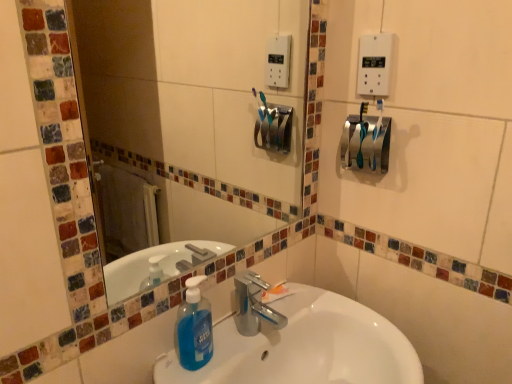
Measure the distance between point (365, 75) and camera.

The distance of point (365, 75) from camera is 1.04 meters.

This screenshot has width=512, height=384. Describe the element at coordinates (198, 102) in the screenshot. I see `glass mosaic mirror at upper center` at that location.

This screenshot has width=512, height=384. Describe the element at coordinates (194, 327) in the screenshot. I see `blue translucent liquid soap at center` at that location.

At what (x,y) coordinates should I click in order to perform the action: click on white plastic light switch at upper right. Please return your answer as a coordinate pair (x, y). The height and width of the screenshot is (384, 512). Looking at the image, I should click on (376, 64).

Considering the positions of objects white glossy sink at center and blue translucent liquid soap at center in the image provided, who is behind, white glossy sink at center or blue translucent liquid soap at center?

blue translucent liquid soap at center is behind.

Is point (228, 371) closer or farther from the camera than point (190, 323)?

Clearly, point (228, 371) is more distant from the camera than point (190, 323).

Where is `sink located on the right of blue translucent liquid soap at center`? The height and width of the screenshot is (384, 512). sink located on the right of blue translucent liquid soap at center is located at coordinates pos(304,346).

In the scene shown: Could blue translucent liquid soap at center be considered to be inside white glossy sink at center?

Yes, white glossy sink at center is surrounding blue translucent liquid soap at center.

Who is taller, white plastic light switch at upper right or white glossy sink at center?

Standing taller between the two is white glossy sink at center.

Considering the positions of objects white plastic light switch at upper right and white glossy sink at center in the image provided, who is more to the right, white plastic light switch at upper right or white glossy sink at center?

white plastic light switch at upper right.

Is white plastic light switch at upper right directly adjacent to white glossy sink at center?

No.

Are white plastic light switch at upper right and glass mosaic mirror at upper center far apart?

No, white plastic light switch at upper right is in close proximity to glass mosaic mirror at upper center.

From the picture: Based on their positions, is white plastic light switch at upper right located to the left or right of glass mosaic mirror at upper center?

Based on their positions, white plastic light switch at upper right is located to the right of glass mosaic mirror at upper center.

Considering the relative sizes of white plastic light switch at upper right and glass mosaic mirror at upper center in the image provided, is white plastic light switch at upper right taller than glass mosaic mirror at upper center?

No, white plastic light switch at upper right is not taller than glass mosaic mirror at upper center.

Is white plastic light switch at upper right inside or outside of glass mosaic mirror at upper center?

white plastic light switch at upper right exists outside the volume of glass mosaic mirror at upper center.

Would you say white plastic light switch at upper right contains blue translucent liquid soap at center?

No, white plastic light switch at upper right does not contain blue translucent liquid soap at center.

Between white plastic light switch at upper right and blue translucent liquid soap at center, which one is positioned behind?

white plastic light switch at upper right.

Considering the sizes of objects white plastic light switch at upper right and blue translucent liquid soap at center in the image provided, who is thinner, white plastic light switch at upper right or blue translucent liquid soap at center?

white plastic light switch at upper right.

Visually, is white plastic light switch at upper right positioned to the left or to the right of blue translucent liquid soap at center?

In the image, white plastic light switch at upper right appears on the right side of blue translucent liquid soap at center.

Is white glossy sink at center shorter than white plastic light switch at upper right?

In fact, white glossy sink at center may be taller than white plastic light switch at upper right.

Does white glossy sink at center appear on the left side of white plastic light switch at upper right?

Yes, white glossy sink at center is to the left of white plastic light switch at upper right.

Looking at this image, which point is more distant from viewer, (292, 363) or (387, 88)?

Positioned behind is point (292, 363).

This screenshot has height=384, width=512. I want to click on light switch that is in front of the satin silver towel bar at upper right, so click(376, 64).

Is satin silver towel bar at upper right not within white plastic light switch at upper right?

Yes, satin silver towel bar at upper right is located beyond the bounds of white plastic light switch at upper right.

Is satin silver towel bar at upper right wider than white plastic light switch at upper right?

Yes.

From the image's perspective, who appears lower, satin silver towel bar at upper right or white plastic light switch at upper right?

satin silver towel bar at upper right is shown below in the image.

Does blue translucent liquid soap at center have a lesser width compared to satin silver towel bar at upper right?

No, blue translucent liquid soap at center is not thinner than satin silver towel bar at upper right.

In order to click on cleaning product located in front of the satin silver towel bar at upper right in this screenshot , I will do `click(194, 327)`.

Which is less distant, (x=186, y=357) or (x=383, y=154)?

Point (x=186, y=357) is closer to the camera than point (x=383, y=154).

The height and width of the screenshot is (384, 512). I want to click on cleaning product above the white glossy sink at center (from the image's perspective), so click(194, 327).

At what (x,y) coordinates should I click in order to perform the action: click on sink below the white plastic light switch at upper right (from the image's perspective). Please return your answer as a coordinate pair (x, y). Looking at the image, I should click on [304, 346].

Based on their spatial positions, is satin silver towel bar at upper right or glass mosaic mirror at upper center further from white plastic light switch at upper right?

glass mosaic mirror at upper center.

Looking at the image, which one is located further to blue translucent liquid soap at center, glass mosaic mirror at upper center or white glossy sink at center?

Based on the image, glass mosaic mirror at upper center appears to be further to blue translucent liquid soap at center.

Based on their spatial positions, is satin silver towel bar at upper right or white plastic light switch at upper right further from glass mosaic mirror at upper center?

white plastic light switch at upper right is positioned further to the anchor glass mosaic mirror at upper center.

Looking at the image, which one is located closer to white plastic light switch at upper right, satin silver towel bar at upper right or blue translucent liquid soap at center?

satin silver towel bar at upper right is positioned closer to the anchor white plastic light switch at upper right.

Looking at the image, which one is located further to satin silver towel bar at upper right, white glossy sink at center or blue translucent liquid soap at center?

blue translucent liquid soap at center is further to satin silver towel bar at upper right.

Looking at the image, which one is located further to satin silver towel bar at upper right, white glossy sink at center or white plastic light switch at upper right?

Based on the image, white glossy sink at center appears to be further to satin silver towel bar at upper right.

Estimate the real-world distances between objects in this image. Which object is further from white plastic light switch at upper right, satin silver towel bar at upper right or white glossy sink at center?

white glossy sink at center lies further to white plastic light switch at upper right than the other object.

Considering their positions, is glass mosaic mirror at upper center positioned further to blue translucent liquid soap at center than satin silver towel bar at upper right?

glass mosaic mirror at upper center is positioned further to the anchor blue translucent liquid soap at center.

Find the location of `towel bar between white plastic light switch at upper right and blue translucent liquid soap at center in the up-down direction`. towel bar between white plastic light switch at upper right and blue translucent liquid soap at center in the up-down direction is located at coordinates [366, 144].

The width and height of the screenshot is (512, 384). Find the location of `cleaning product between satin silver towel bar at upper right and white glossy sink at center vertically`. cleaning product between satin silver towel bar at upper right and white glossy sink at center vertically is located at coordinates (194, 327).

The image size is (512, 384). I want to click on cleaning product between white plastic light switch at upper right and white glossy sink at center vertically, so click(194, 327).

Locate an element on the screen. light switch positioned between glass mosaic mirror at upper center and satin silver towel bar at upper right from near to far is located at coordinates (376, 64).